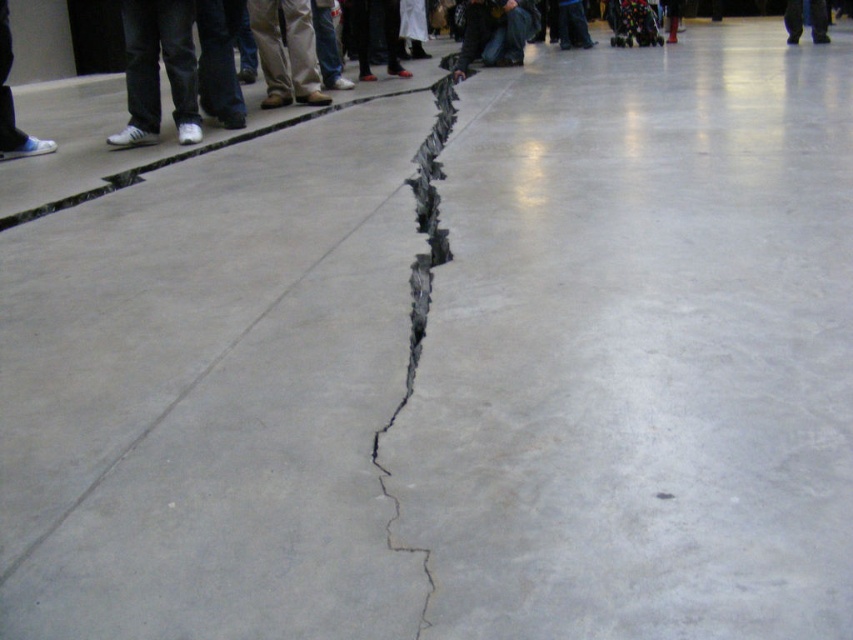
Question: Among these points, which one is nearest to the camera?

Choices:
 (A) (793, 20)
 (B) (415, 211)
 (C) (126, 96)
 (D) (16, 132)

Answer: (B)

Question: Which point is closer to the camera?

Choices:
 (A) (1, 70)
 (B) (799, 13)

Answer: (A)

Question: Which of the following is the closest to the observer?

Choices:
 (A) (263, 10)
 (B) (453, 100)

Answer: (B)

Question: From the image, what is the correct spatial relationship of white leather shoes at left in relation to gray concrete crack at center?

Choices:
 (A) left
 (B) right

Answer: (A)

Question: Can you confirm if white leather shoes at left is thinner than gray concrete crack at center?

Choices:
 (A) yes
 (B) no

Answer: (B)

Question: Does white leather shoes at left have a greater width compared to gray concrete crack at center?

Choices:
 (A) yes
 (B) no

Answer: (A)